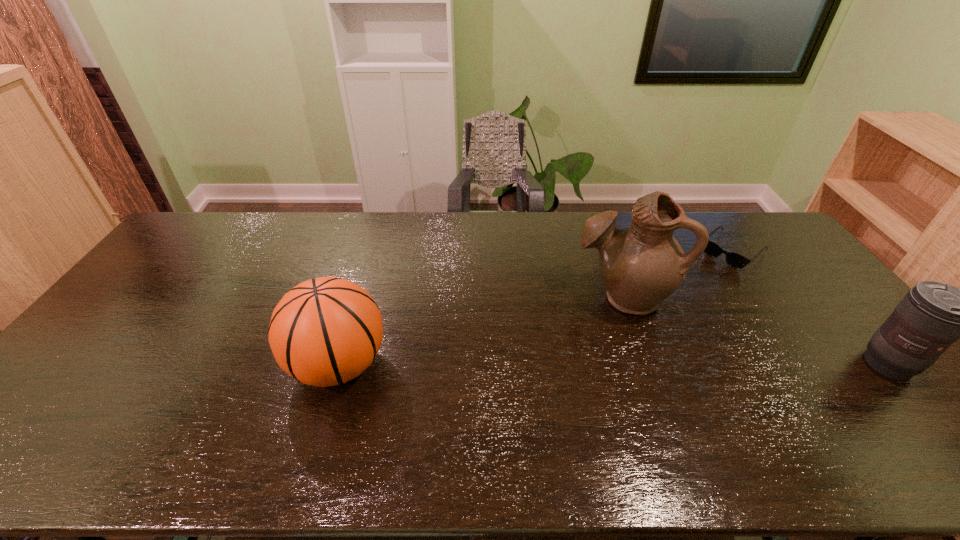
Locate an element on the screen. The width and height of the screenshot is (960, 540). free point between the telephoto lens and the pitcher is located at coordinates (756, 330).

This screenshot has height=540, width=960. What are the coordinates of `vacant area that lies between the tallest object and the rightmost object` in the screenshot? It's located at click(x=756, y=330).

Find the location of a particular element. The height and width of the screenshot is (540, 960). free area in between the second object from right to left and the leftmost object is located at coordinates (536, 308).

Identify which object is located as the second nearest to the rightmost object. Please provide its 2D coordinates. Your answer should be formatted as a tuple, i.e. [(x, y)], where the tuple contains the x and y coordinates of a point satisfying the conditions above.

[(642, 265)]

Point out which object is positioned as the third nearest to the second object from left to right. Please provide its 2D coordinates. Your answer should be formatted as a tuple, i.e. [(x, y)], where the tuple contains the x and y coordinates of a point satisfying the conditions above.

[(325, 331)]

Where is `vacant space that satisfies the following two spatial constraints: 1. on the back side of the leftmost object; 2. on the left side of the second object from right to left`? Image resolution: width=960 pixels, height=540 pixels. vacant space that satisfies the following two spatial constraints: 1. on the back side of the leftmost object; 2. on the left side of the second object from right to left is located at coordinates (372, 252).

Identify the location of vacant space that satisfies the following two spatial constraints: 1. on the front side of the rightmost object; 2. on the side of the pitcher where the control switches are located. (646, 363).

The width and height of the screenshot is (960, 540). What are the coordinates of `vacant region that satisfies the following two spatial constraints: 1. on the front side of the tallest object; 2. on the side of the rightmost object where the control switches are located` in the screenshot? It's located at (646, 363).

Locate an element on the screen. Image resolution: width=960 pixels, height=540 pixels. blank area in the image that satisfies the following two spatial constraints: 1. on the back side of the sunglasses; 2. on the right side of the pitcher is located at coordinates (607, 252).